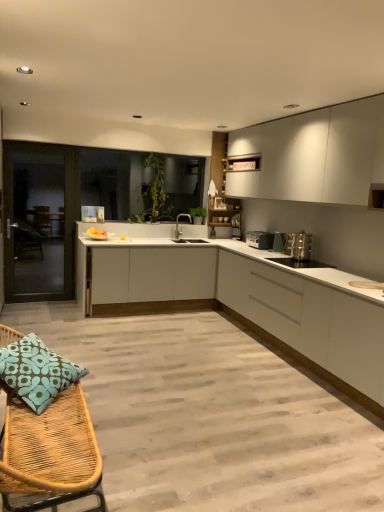
This screenshot has height=512, width=384. Identify the location of free space in front of white matte cabinet at center, placed as the 2th cabinetry when sorted from top to bottom. (187, 342).